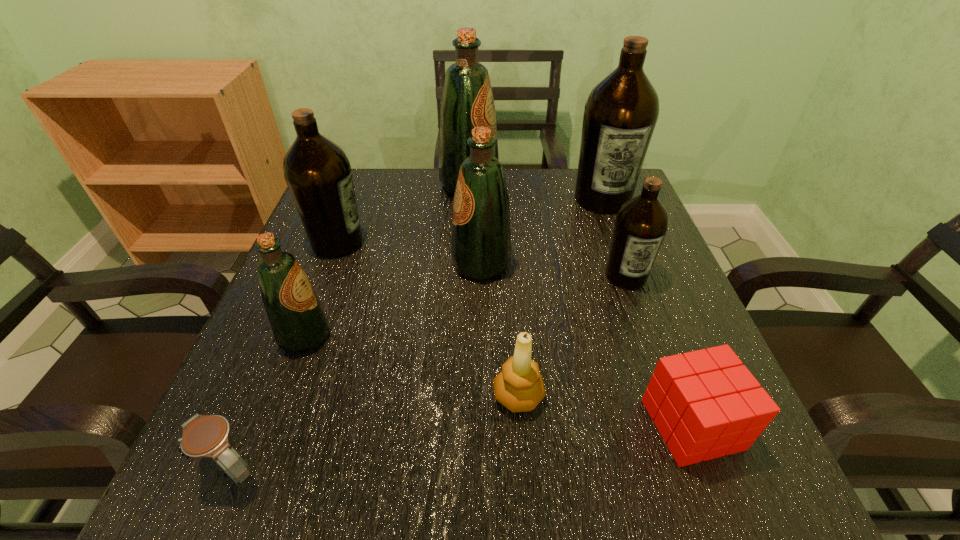
The image size is (960, 540). Identify the location of free space that is in between the second nearest green olive oil and the cube. (587, 345).

This screenshot has height=540, width=960. I want to click on free space between the second nearest green olive oil and the leftmost green olive oil, so click(393, 300).

Identify the location of vacant point located between the watch and the second nearest brown olive oil. (285, 355).

You are a GUI agent. You are given a task and a screenshot of the screen. Output one action in this format:
    pyautogui.click(x=<x>, y=<y>)
    Task: Click on the vacant space that is in between the watch and the second biggest brown olive oil
    Image resolution: width=960 pixels, height=540 pixels.
    Given the screenshot: What is the action you would take?
    pyautogui.click(x=285, y=355)

Find the location of a particular element. This screenshot has width=960, height=540. the second closest object relative to the farthest green olive oil is located at coordinates (317, 171).

I want to click on object that can be found as the fifth closest to the biggest green olive oil, so click(x=298, y=321).

Select which olive oil is the third closest to the watch. Please provide its 2D coordinates. Your answer should be formatted as a tuple, i.e. [(x, y)], where the tuple contains the x and y coordinates of a point satisfying the conditions above.

[(481, 240)]

The width and height of the screenshot is (960, 540). Identify the location of the fourth closest olive oil relative to the gray watch. (641, 223).

Where is `the second closest brown olive oil to the smallest brown olive oil`? the second closest brown olive oil to the smallest brown olive oil is located at coordinates (317, 171).

This screenshot has width=960, height=540. In order to click on the closest brown olive oil relative to the smallest brown olive oil in this screenshot , I will do pyautogui.click(x=620, y=115).